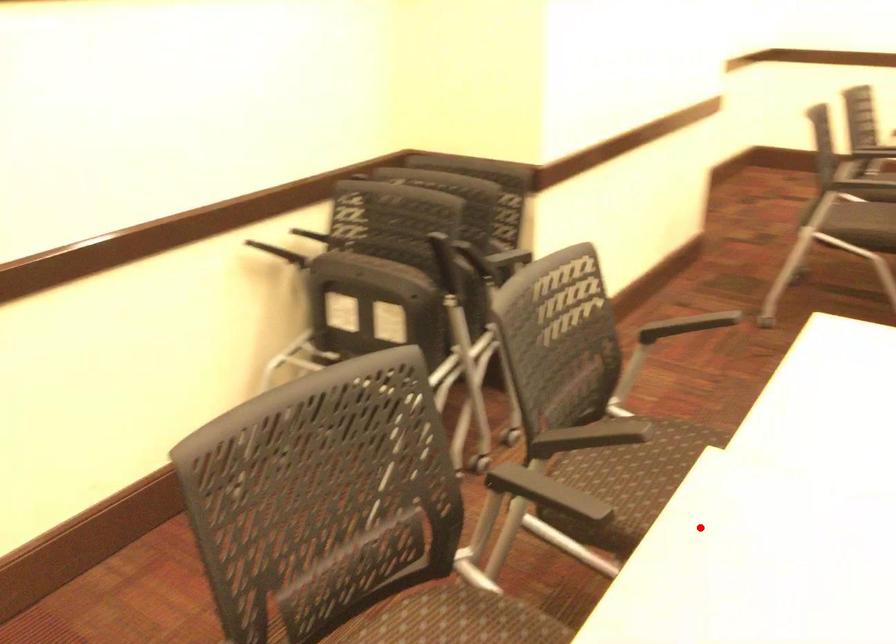
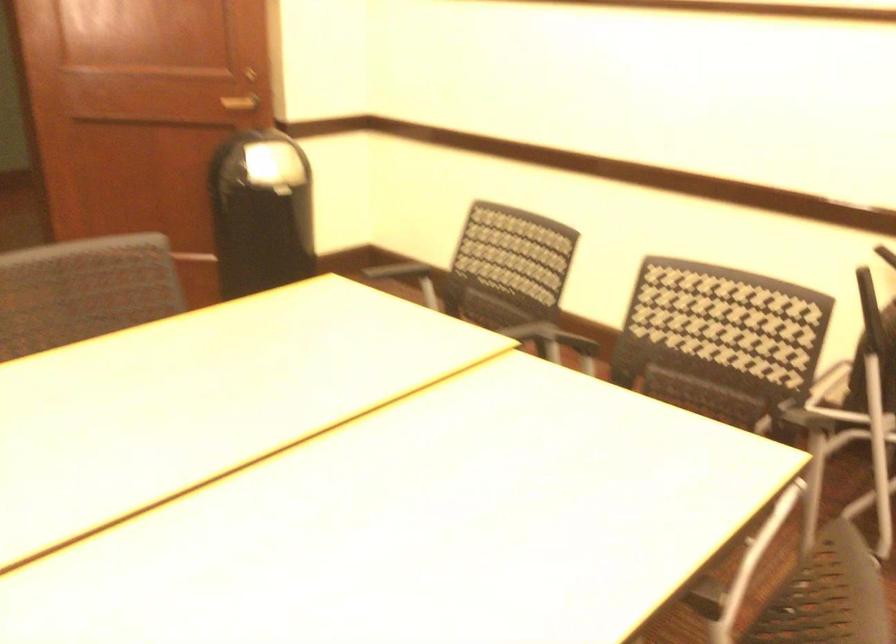
Question: I am providing you with two images of the same scene from different viewpoints. A red point is shown in image1. For the corresponding object point in image2, is it positioned nearer or farther from the camera?

Choices:
 (A) Nearer
 (B) Farther

Answer: (B)